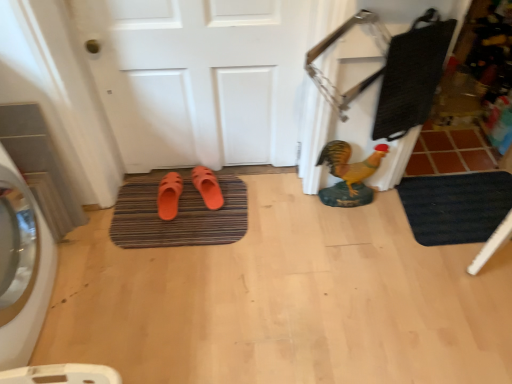
Question: Is black rubber bath mat at lower right, positioned as the first bath mat in right-to-left order, taller or shorter than orange rubber slipper at center, placed as the 1th footwear when sorted from right to left?

Choices:
 (A) short
 (B) tall

Answer: (A)

Question: From the image's perspective, is black rubber bath mat at lower right, positioned as the first bath mat in right-to-left order, above or below orange rubber slipper at center, placed as the 1th footwear when sorted from right to left?

Choices:
 (A) below
 (B) above

Answer: (A)

Question: Estimate the real-world distances between objects in this image. Which object is farther from the white glossy washing machine at left?

Choices:
 (A) yellow matte chicken at center-right
 (B) brown textured bath mat at center, the 2th bath mat from the right
 (C) orange rubber slipper at center, marked as the 2th footwear in a left-to-right arrangement
 (D) brown tile at right
 (E) black rubber bath mat at lower right, which is counted as the second bath mat, starting from the left

Answer: (D)

Question: Estimate the real-world distances between objects in this image. Which object is closer to the white matte door at center?

Choices:
 (A) black rubber bath mat at lower right, which is counted as the second bath mat, starting from the left
 (B) orange rubber slipper at center, placed as the 1th footwear when sorted from right to left
 (C) orange rubber slipper at center, marked as the 2th footwear in a right-to-left arrangement
 (D) brown tile at right
 (E) white glossy washing machine at left

Answer: (B)